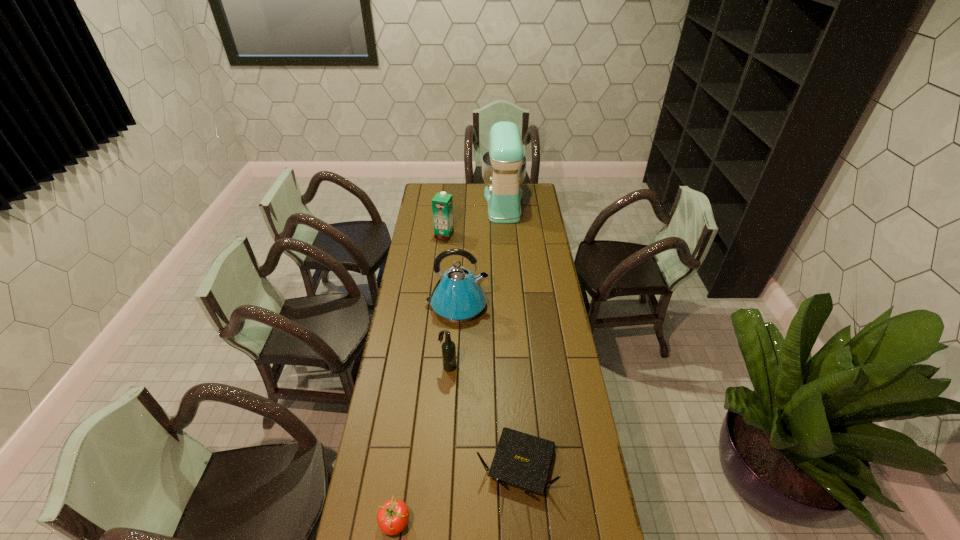
This screenshot has height=540, width=960. In order to click on vacant space situated 0.400m at the base of the farthest object in this screenshot , I will do `click(418, 203)`.

At what (x,y) coordinates should I click in order to perform the action: click on vacant space situated 0.330m at the base of the farthest object. Please return your answer as a coordinate pair (x, y). This screenshot has width=960, height=540. Looking at the image, I should click on (429, 203).

What are the coordinates of `vacant space located 0.340m at the spout of the kettle` in the screenshot? It's located at (560, 305).

Find the location of a particular element. The height and width of the screenshot is (540, 960). free space located 0.090m on the back of the carton is located at coordinates (445, 221).

Find the location of a particular element. Image resolution: width=960 pixels, height=540 pixels. free spot located 0.150m on the front of the beer bottle is located at coordinates (445, 405).

Identify the location of blank space located on the back of the second shortest object. (510, 347).

The height and width of the screenshot is (540, 960). What are the coordinates of `object that is at the far edge` in the screenshot? It's located at (504, 166).

At what (x,y) coordinates should I click in order to perform the action: click on kettle that is at the left edge. Please return your answer as a coordinate pair (x, y). This screenshot has height=540, width=960. Looking at the image, I should click on (458, 296).

At what (x,y) coordinates should I click in order to perform the action: click on carton present at the left edge. Please return your answer as a coordinate pair (x, y). Looking at the image, I should click on (442, 204).

Locate an element on the screen. The width and height of the screenshot is (960, 540). mixer that is at the right edge is located at coordinates (504, 166).